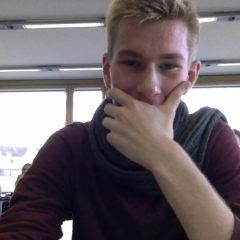
Identify the location of windows. The width and height of the screenshot is (240, 240). (48, 115), (83, 108), (217, 96).